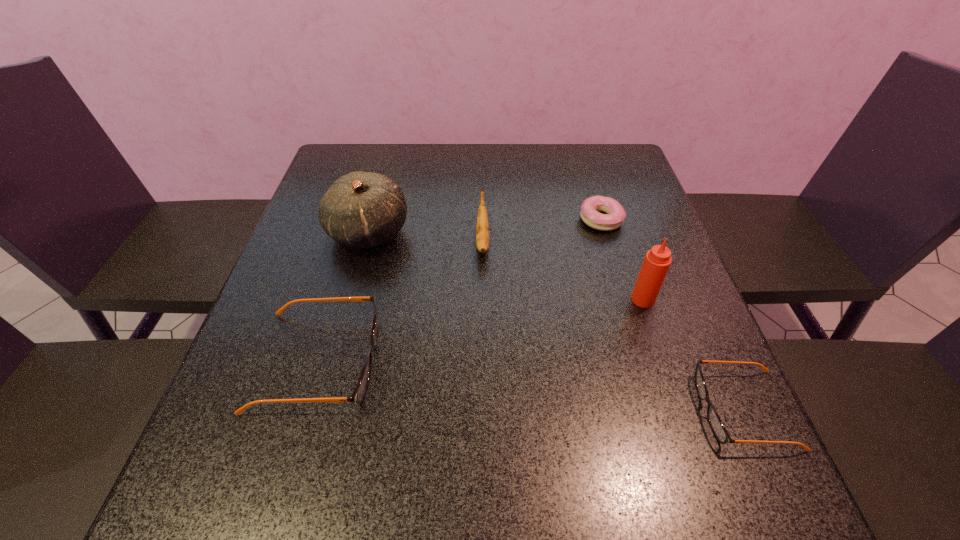
I want to click on free space at the near right corner, so click(735, 396).

Find the location of a particular element. The height and width of the screenshot is (540, 960). free space between the fourth farthest object and the gourd is located at coordinates (506, 266).

The height and width of the screenshot is (540, 960). Identify the location of empty space that is in between the third object from left to right and the doughnut. (541, 230).

Find the location of a particular element. The height and width of the screenshot is (540, 960). free space between the Tabasco sauce and the left spectacles is located at coordinates (481, 330).

Where is `free spot between the right spectacles and the fourth tallest object`? The image size is (960, 540). free spot between the right spectacles and the fourth tallest object is located at coordinates (531, 385).

Where is `free space between the banana and the gourd`? free space between the banana and the gourd is located at coordinates (425, 237).

Image resolution: width=960 pixels, height=540 pixels. What are the coordinates of `vacant area between the banana and the gourd` in the screenshot? It's located at (425, 237).

Identify the location of empty space between the banana and the left spectacles. pyautogui.click(x=400, y=301).

The image size is (960, 540). Identify the location of empty location between the gourd and the third tallest object. (x=425, y=237).

Where is `vacant point located between the rightmost object and the doughnut`? This screenshot has height=540, width=960. vacant point located between the rightmost object and the doughnut is located at coordinates (672, 314).